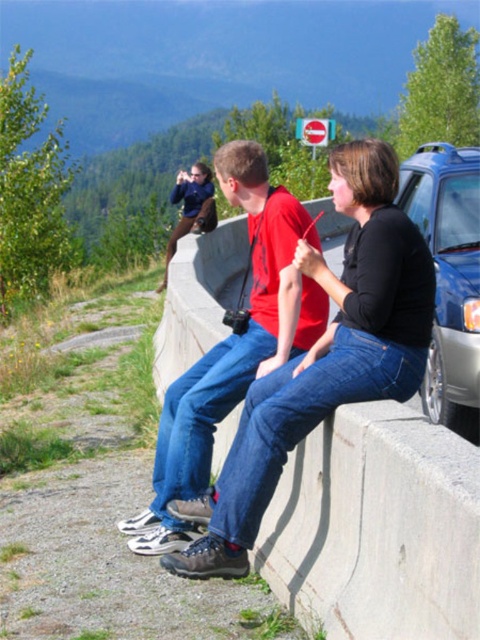
Is red cotton shirt at center behind satin blue car at right?

No, it is not.

Is red cotton shirt at center above satin blue car at right?

No.

Which is behind, point (182, 531) or point (423, 173)?

Positioned behind is point (423, 173).

Locate an element on the screen. This screenshot has width=480, height=640. red cotton shirt at center is located at coordinates (232, 346).

Measure the distance between point [415,170] and camera.

A distance of 7.20 meters exists between point [415,170] and camera.

Can you confirm if satin blue car at right is bigger than matte black jacket at upper center?

Actually, satin blue car at right might be smaller than matte black jacket at upper center.

I want to click on satin blue car at right, so click(448, 276).

Between concrete at center and satin blue car at right, which one appears on the left side from the viewer's perspective?

From the viewer's perspective, concrete at center appears more on the left side.

Is concrete at center closer to the viewer compared to satin blue car at right?

Yes.

Where is `concrete at center`? concrete at center is located at coordinates (376, 528).

Identify the location of concrete at center. Image resolution: width=480 pixels, height=640 pixels. (376, 528).